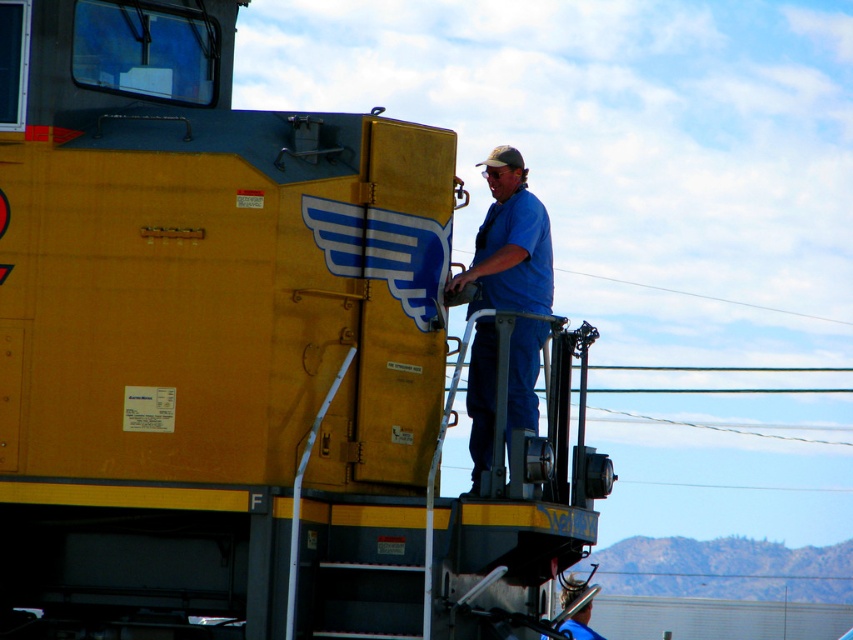
From the picture: You are a safety inspector standing near the yellow matte train at center. You need to check if the distance between you and the blue cotton shirt at center is within the 30 inch safety zone. Can you confirm?

The yellow matte train at center and blue cotton shirt at center are 28.12 inches apart. Since 28.12 inches is less than 30 inches, the distance is within the safety zone.

Based on the scene description, where is the yellow matte train at center located in terms of coordinates?

The yellow matte train at center is located at coordinates point (236,356).

You are a safety inspector on the yellow matte train at center. You need to check the condition of the blue cotton shirt at center. Can you reach it from your current position on the train?

The yellow matte train at center is located below the blue cotton shirt at center, so you can reach it by climbing up from the train.